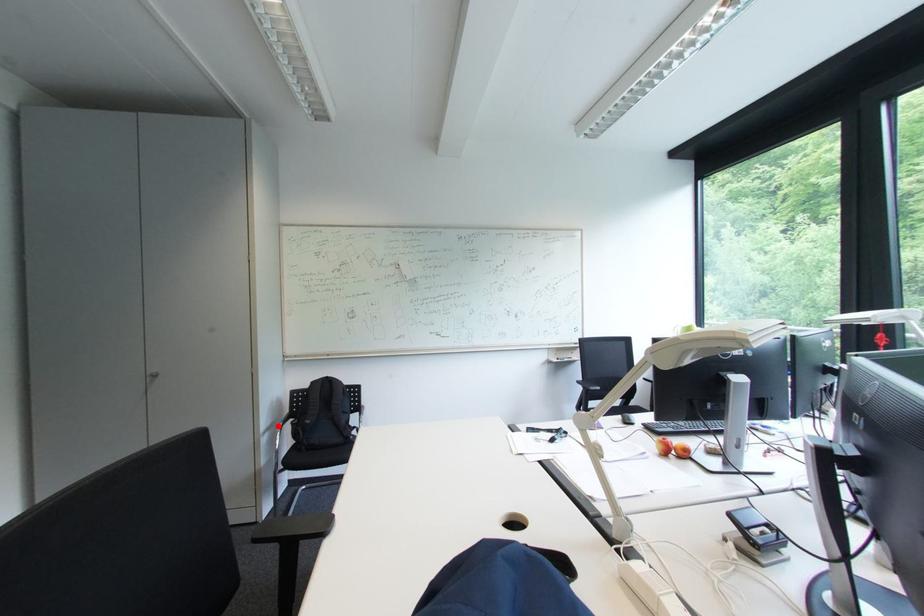
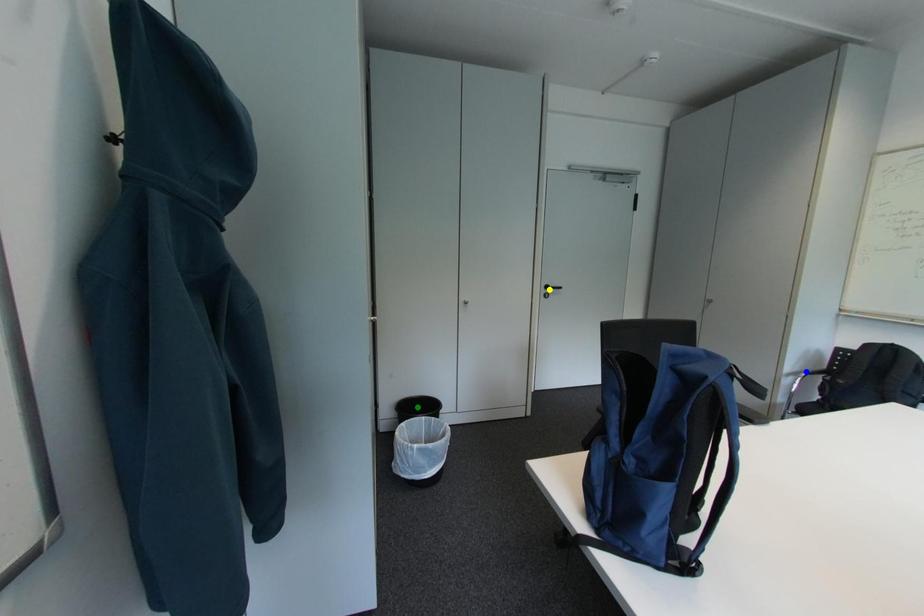
Question: I am providing you with two images of the same scene from different viewpoints. A red point is marked on the first image. You are given multiple points on the second image. Which point in image 2 is actually the same real-world point as the red point in image 1?

Choices:
 (A) yellow point
 (B) green point
 (C) blue point

Answer: (C)